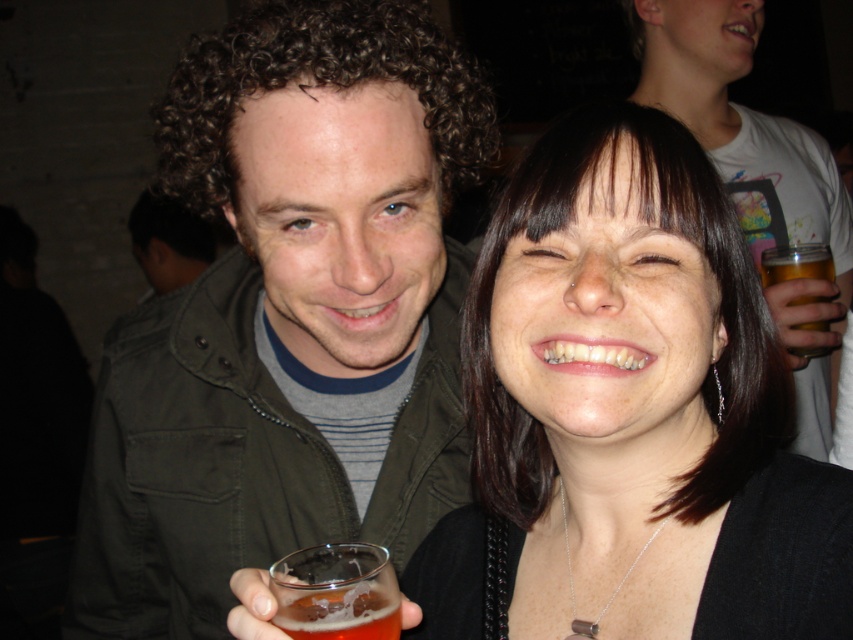
Is matte gray jacket at center positioned before golden amber liquid at upper right?

Yes, matte gray jacket at center is closer to the viewer.

Between point (659, 60) and point (795, 253), which one is positioned in front?

Point (795, 253) is in front.

Find the location of a particular element. The height and width of the screenshot is (640, 853). matte gray jacket at center is located at coordinates (747, 145).

Can you confirm if matte black hair at center is taller than matte gray jacket at center?

No, matte black hair at center is not taller than matte gray jacket at center.

This screenshot has height=640, width=853. Identify the location of matte black hair at center. (630, 404).

Who is lower down, matte gray jacket at center or translucent glass at lower center?

translucent glass at lower center is below.

The width and height of the screenshot is (853, 640). Describe the element at coordinates (747, 145) in the screenshot. I see `matte gray jacket at center` at that location.

Measure the distance between matte gray jacket at center and camera.

A distance of 4.23 feet exists between matte gray jacket at center and camera.

In order to click on matte gray jacket at center in this screenshot , I will do `click(747, 145)`.